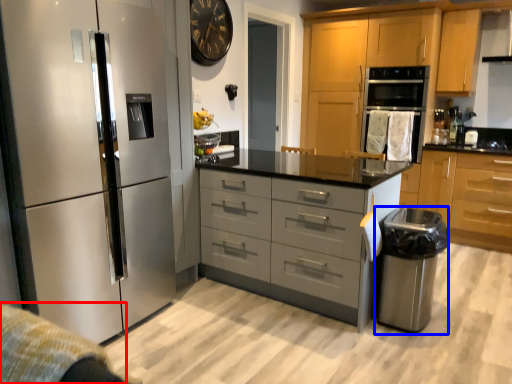
Question: Among these objects, which one is farthest to the camera, gray (highlighted by a red box) or appliance (highlighted by a blue box)?

Choices:
 (A) gray
 (B) appliance

Answer: (B)